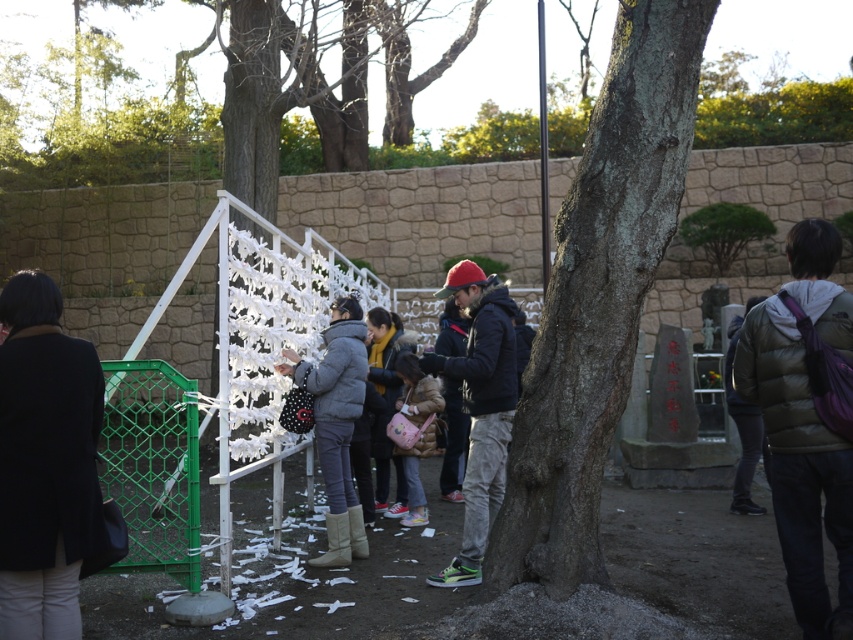
Question: Which object is the farthest from the dark green jacket at right?

Choices:
 (A) dark gray fleece jacket at center
 (B) green mesh gate at lower left
 (C) matte gray jacket at center

Answer: (B)

Question: In this image, where is green puffy jacket at right located relative to green mesh gate at lower left?

Choices:
 (A) left
 (B) right

Answer: (B)

Question: Which object is the closest to the dark gray fleece jacket at center?

Choices:
 (A) matte gray jacket at center
 (B) dark brown rough bark tree at center
 (C) green puffy jacket at right
 (D) black wool coat at left

Answer: (A)

Question: Does green puffy jacket at right appear under dark gray fleece jacket at center?

Choices:
 (A) no
 (B) yes

Answer: (A)

Question: Is the position of black wool coat at left more distant than that of dark green jacket at right?

Choices:
 (A) no
 (B) yes

Answer: (A)

Question: Estimate the real-world distances between objects in this image. Which object is closer to the green mesh gate at lower left?

Choices:
 (A) matte gray jacket at center
 (B) dark gray fleece jacket at center
 (C) green puffy jacket at right
 (D) dark green jacket at right

Answer: (A)